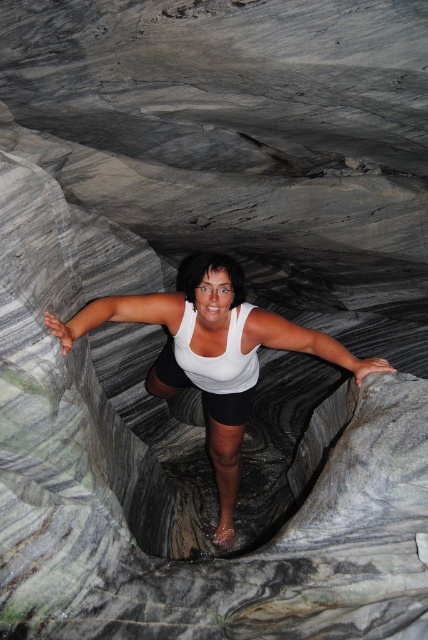
Question: Which of these objects is positioned farthest from the white matte tank top at center?

Choices:
 (A) white smooth arm at center
 (B) white matte arm at center

Answer: (B)

Question: Does white matte tank top at center have a larger size compared to white smooth arm at center?

Choices:
 (A) yes
 (B) no

Answer: (A)

Question: Which object appears farthest from the camera in this image?

Choices:
 (A) white matte arm at center
 (B) white matte tank top at center
 (C) white smooth arm at center

Answer: (A)

Question: Is white matte tank top at center to the right of white smooth arm at center from the viewer's perspective?

Choices:
 (A) yes
 (B) no

Answer: (A)

Question: Among these objects, which one is farthest from the camera?

Choices:
 (A) white matte tank top at center
 (B) white smooth arm at center
 (C) white matte arm at center

Answer: (C)

Question: Does white matte tank top at center come behind white smooth arm at center?

Choices:
 (A) yes
 (B) no

Answer: (A)